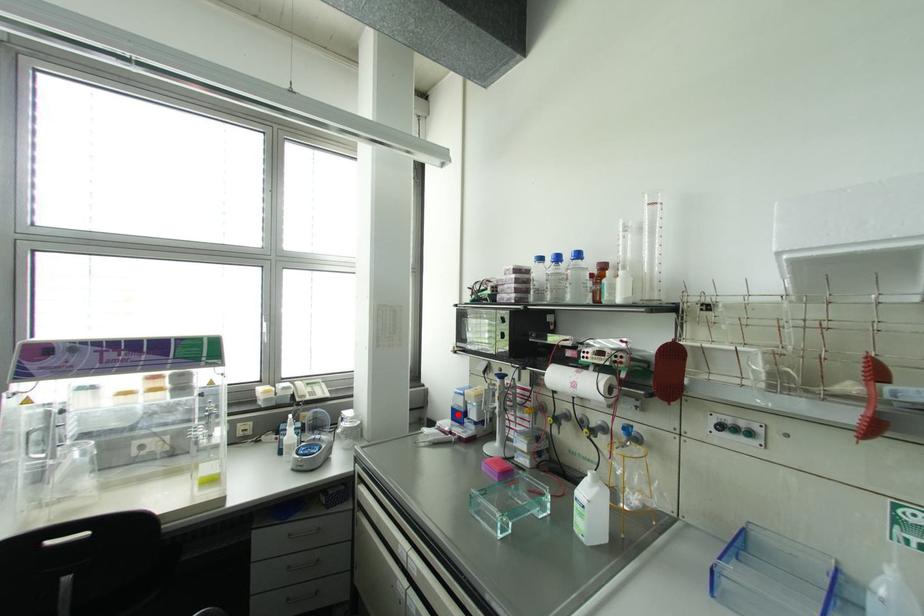
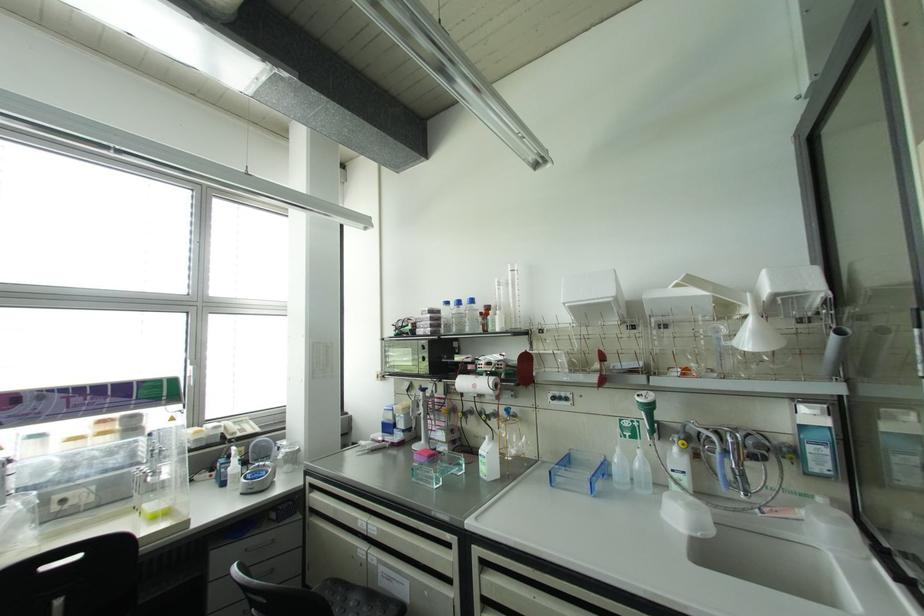
In the second image, find the point that corresponds to the highlighted location in the first image.

(387, 427)